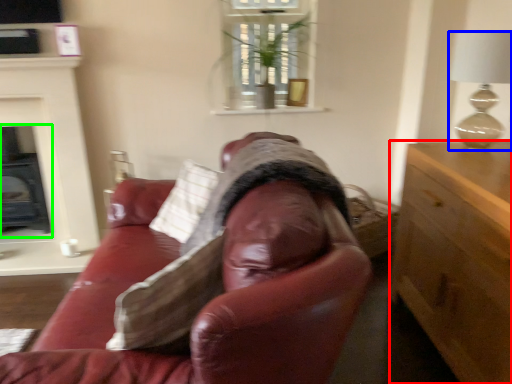
Question: Considering the real-world distances, which object is closest to cabinetry (highlighted by a red box)? lamp (highlighted by a blue box) or fireplace (highlighted by a green box).

Choices:
 (A) lamp
 (B) fireplace

Answer: (A)